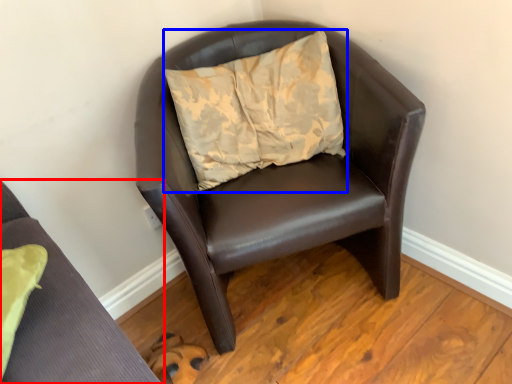
Question: Which object is closer to the camera taking this photo, chair (highlighted by a red box) or pillow (highlighted by a blue box)?

Choices:
 (A) chair
 (B) pillow

Answer: (A)